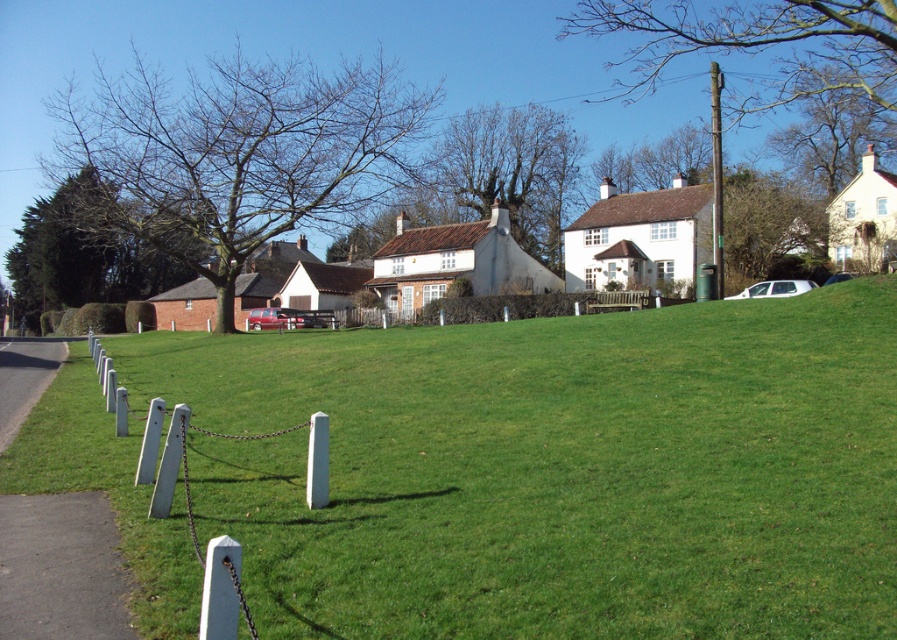
Measure the distance from green grass at center to green metallic pole at upper right.

green grass at center and green metallic pole at upper right are 17.49 meters apart.

Does point (745, 432) lie behind point (721, 218)?

No, (745, 432) is in front of (721, 218).

Who is more forward, (x=760, y=353) or (x=710, y=64)?

Point (x=760, y=353) is in front.

At what (x,y) coordinates should I click in order to perform the action: click on green grass at center. Please return your answer as a coordinate pair (x, y). Looking at the image, I should click on (556, 470).

Does green metallic pole at upper right have a smaller size compared to white matte car at right?

Incorrect, green metallic pole at upper right is not smaller in size than white matte car at right.

Who is shorter, green metallic pole at upper right or white matte car at right?

white matte car at right

I want to click on green metallic pole at upper right, so click(x=716, y=177).

Is the position of green grass at center more distant than that of white matte car at right?

That is False.

Can you confirm if green grass at center is positioned to the left of white matte car at right?

Yes, green grass at center is to the left of white matte car at right.

Who is more forward, (x=667, y=358) or (x=817, y=285)?

Point (x=667, y=358) is in front.

The height and width of the screenshot is (640, 897). In order to click on green grass at center in this screenshot , I will do `click(556, 470)`.